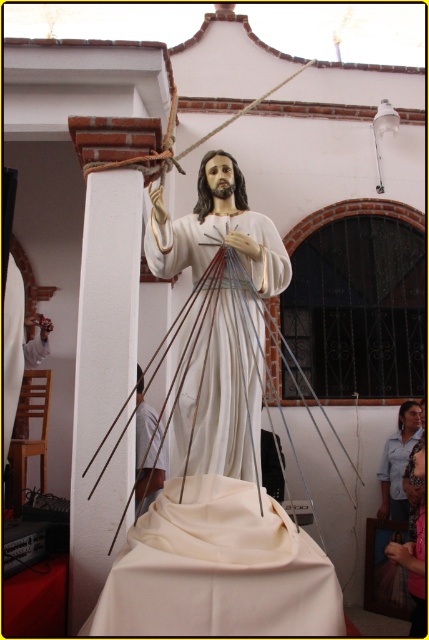
Question: Which point is closer to the camera taking this photo?

Choices:
 (A) (150, 480)
 (B) (223, 452)

Answer: (B)

Question: Which point is closer to the camera?

Choices:
 (A) (138, 394)
 (B) (156, 259)

Answer: (B)

Question: Which of the following is the closest to the observer?

Choices:
 (A) (190, 339)
 (B) (144, 509)

Answer: (A)

Question: Can you confirm if white glossy statue at center is wider than white fabric at lower center?

Choices:
 (A) yes
 (B) no

Answer: (A)

Question: Can you confirm if white glossy statue at center is positioned below white fabric at lower center?

Choices:
 (A) yes
 (B) no

Answer: (B)

Question: Is white glossy statue at center bigger than white fabric at lower center?

Choices:
 (A) no
 (B) yes

Answer: (B)